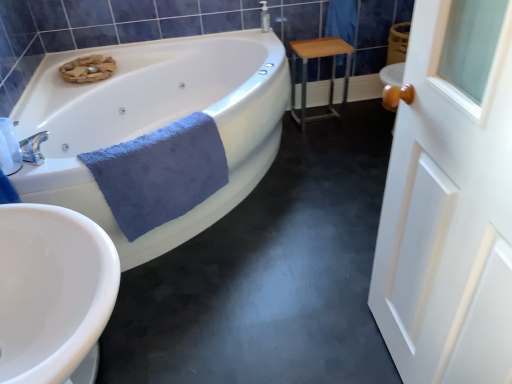
Question: Based on their positions, is white wooden door at right located to the left or right of blue soft towel at lower left?

Choices:
 (A) right
 (B) left

Answer: (A)

Question: From a real-world perspective, relative to blue soft towel at lower left, is white wooden door at right vertically above or below?

Choices:
 (A) below
 (B) above

Answer: (B)

Question: Considering the real-world distances, which object is farthest from the white glossy electric kettle at left?

Choices:
 (A) white glossy bathtub at upper left
 (B) light brown wood table at center right
 (C) white wooden door at right
 (D) blue soft towel at lower left

Answer: (B)

Question: Which of these objects is positioned farthest from the blue soft towel at lower left?

Choices:
 (A) white glossy bathtub at upper left
 (B) white wooden door at right
 (C) light brown wood table at center right
 (D) white glossy electric kettle at left

Answer: (C)